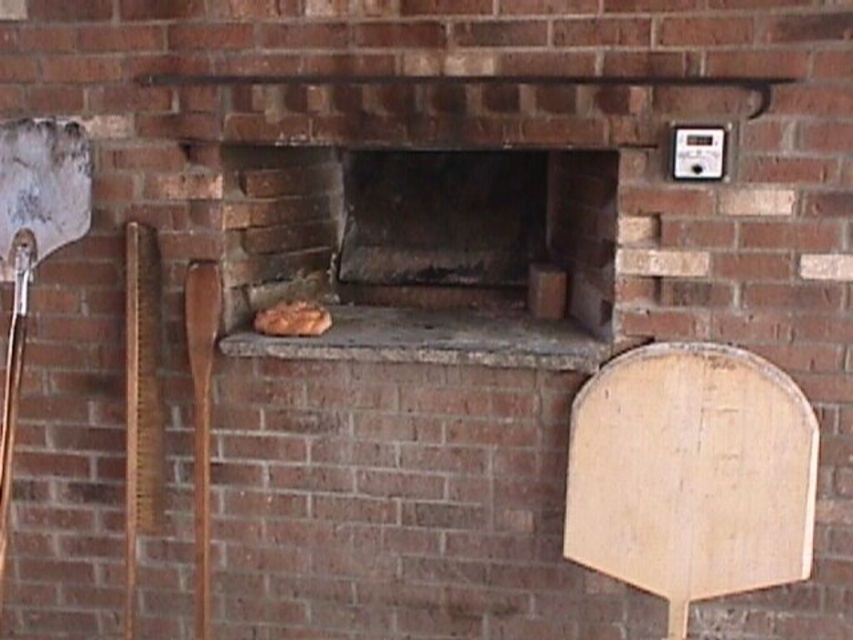
You are a baker who just finished baking bread in the brick oven. You need to move the round loaf from the stone surface to a cooling rack. The silver metallic shovel at left is available. Can you use the shovel to move the loaf?

The silver metallic shovel at left is located at point (33,243), which is to the left of the oven. Since the shovel is positioned near the oven, you can use it to carefully lift and move the round loaf from the stone surface to the cooling rack.

You are standing in front of the brick oven and need to retrieve the silver metallic shovel at left. Based on its coordinates, where should you look to find it?

The silver metallic shovel at left is located at the coordinates point (x=33, y=243), so you should look to the lower left area near the oven to find it.